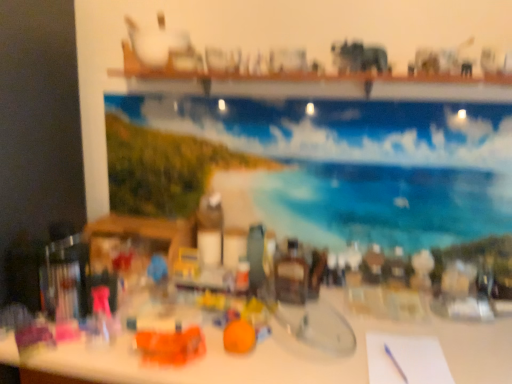
You are a GUI agent. You are given a task and a screenshot of the screen. Output one action in this format:
    pyautogui.click(x=<x>, y=<y>)
    Task: Click on the vacant area that lies to the right of orange matte toy at center, which is the 2th toy from left to right
    
    Given the screenshot: What is the action you would take?
    pyautogui.click(x=295, y=352)